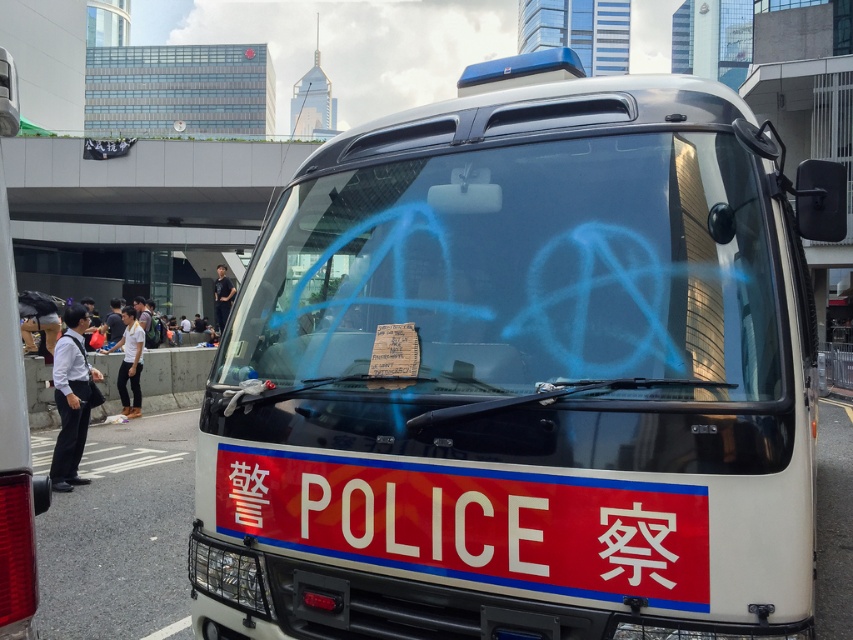
Which is in front, point (761, 486) or point (514, 364)?

Point (761, 486) is in front.

The width and height of the screenshot is (853, 640). Identify the location of white glossy police van at center. (523, 378).